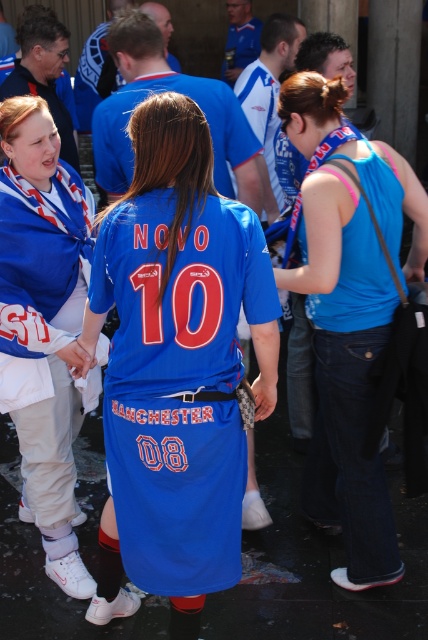
You are a photographer at the event and want to focus your camera on the blue jersey at center and the blue denim jeans at center. Which one should you adjust the focus to first if you want to capture both clearly in the same shot?

The blue jersey at center is located below blue denim jeans at center, so you should focus on the blue denim jeans at center first since it is closer to the camera and adjust the focus accordingly to ensure both are in focus.

You are a photographer at the sports event and want to capture a photo of the person in the blue denim jeans at center and the matte blue jersey at center. Based on their positions, which object is positioned to the right side of the other?

The blue denim jeans at center is to the right of the matte blue jersey at center.